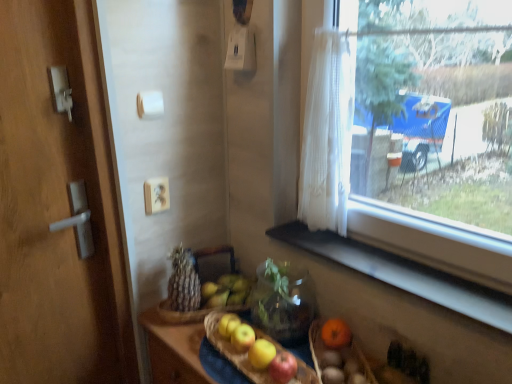
Question: Could you tell me if transparent glass window at upper right is facing black matte window sill at lower right?

Choices:
 (A) no
 (B) yes

Answer: (A)

Question: Considering the relative sizes of transparent glass window at upper right and black matte window sill at lower right in the image provided, is transparent glass window at upper right thinner than black matte window sill at lower right?

Choices:
 (A) yes
 (B) no

Answer: (A)

Question: From the image's perspective, is transparent glass window at upper right under black matte window sill at lower right?

Choices:
 (A) no
 (B) yes

Answer: (A)

Question: Does transparent glass window at upper right come behind black matte window sill at lower right?

Choices:
 (A) no
 (B) yes

Answer: (A)

Question: From the image's perspective, is transparent glass window at upper right over black matte window sill at lower right?

Choices:
 (A) yes
 (B) no

Answer: (A)

Question: Considering the relative positions of transparent glass window at upper right and black matte window sill at lower right in the image provided, is transparent glass window at upper right to the left of black matte window sill at lower right from the viewer's perspective?

Choices:
 (A) no
 (B) yes

Answer: (A)

Question: Are wooden door handle at left and black matte window sill at lower right making contact?

Choices:
 (A) yes
 (B) no

Answer: (B)

Question: From a real-world perspective, does wooden door handle at left sit lower than black matte window sill at lower right?

Choices:
 (A) no
 (B) yes

Answer: (A)

Question: Is wooden door handle at left thinner than black matte window sill at lower right?

Choices:
 (A) yes
 (B) no

Answer: (A)

Question: From the image's perspective, does wooden door handle at left appear lower than black matte window sill at lower right?

Choices:
 (A) no
 (B) yes

Answer: (A)

Question: Is wooden door handle at left positioned behind black matte window sill at lower right?

Choices:
 (A) yes
 (B) no

Answer: (A)

Question: Are wooden door handle at left and black matte window sill at lower right far apart?

Choices:
 (A) no
 (B) yes

Answer: (A)

Question: Is white sheer curtain at window at the back of black matte window sill at lower right?

Choices:
 (A) no
 (B) yes

Answer: (A)